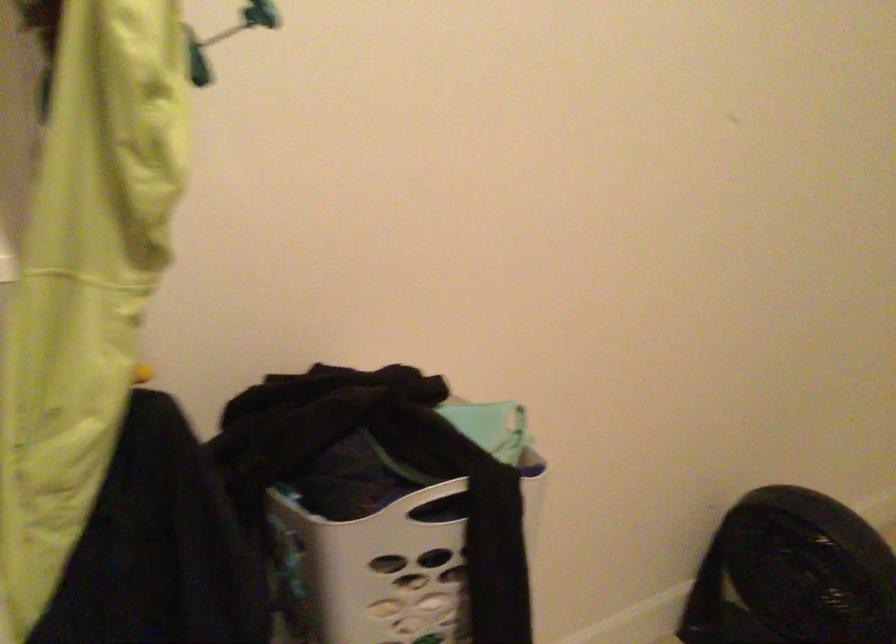
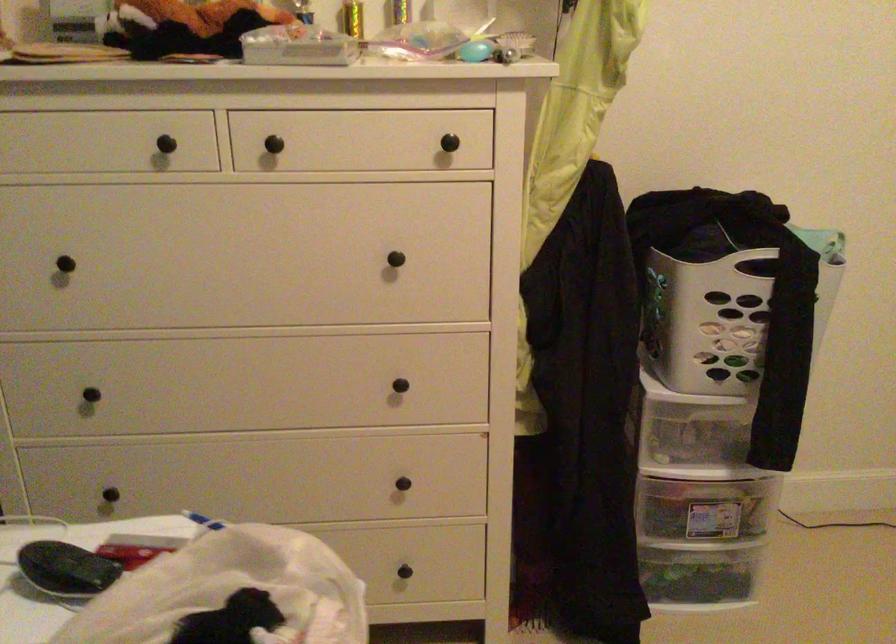
Question: The camera is either moving clockwise (left) or counter-clockwise (right) around the object. The first image is from the beginning of the video and the second image is from the end. Is the camera moving left or right when shooting the video?

Choices:
 (A) Left
 (B) Right

Answer: (B)